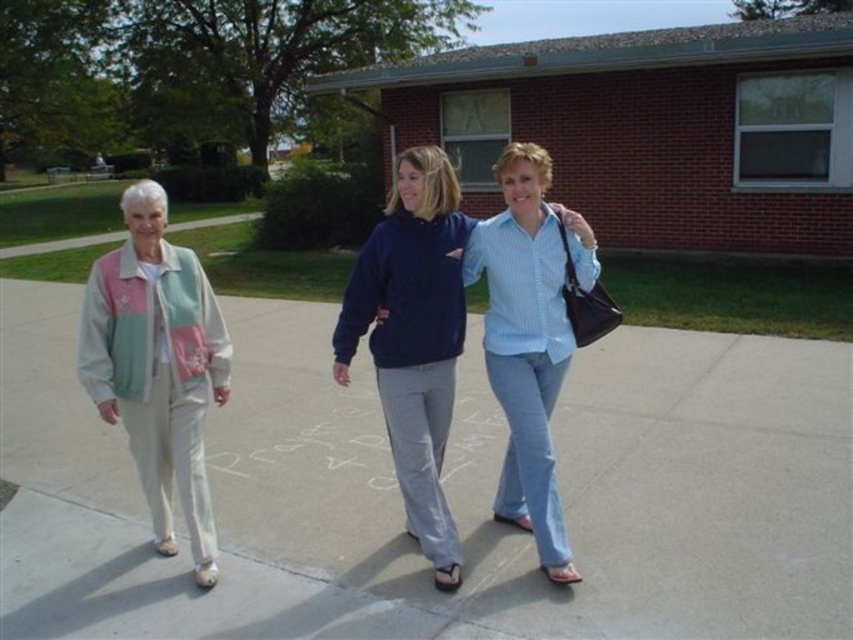
Question: Which object is farther from the camera taking this photo?

Choices:
 (A) blue cotton shirt at center
 (B) light beige fabric jacket at left
 (C) light gray concrete sidewalk at center

Answer: (B)

Question: Which of the following is the closest to the observer?

Choices:
 (A) light beige fabric jacket at left
 (B) light gray concrete sidewalk at center
 (C) blue cotton shirt at center

Answer: (C)

Question: Is light beige fabric jacket at left above light blue denim jeans at center?

Choices:
 (A) yes
 (B) no

Answer: (B)

Question: Is light gray concrete sidewalk at center thinner than light blue denim jeans at center?

Choices:
 (A) no
 (B) yes

Answer: (B)

Question: Can you confirm if light gray concrete sidewalk at center is bigger than blue cotton shirt at center?

Choices:
 (A) yes
 (B) no

Answer: (B)

Question: Estimate the real-world distances between objects in this image. Which object is closer to the light blue denim jeans at center?

Choices:
 (A) light gray concrete sidewalk at center
 (B) light beige fabric jacket at left

Answer: (A)